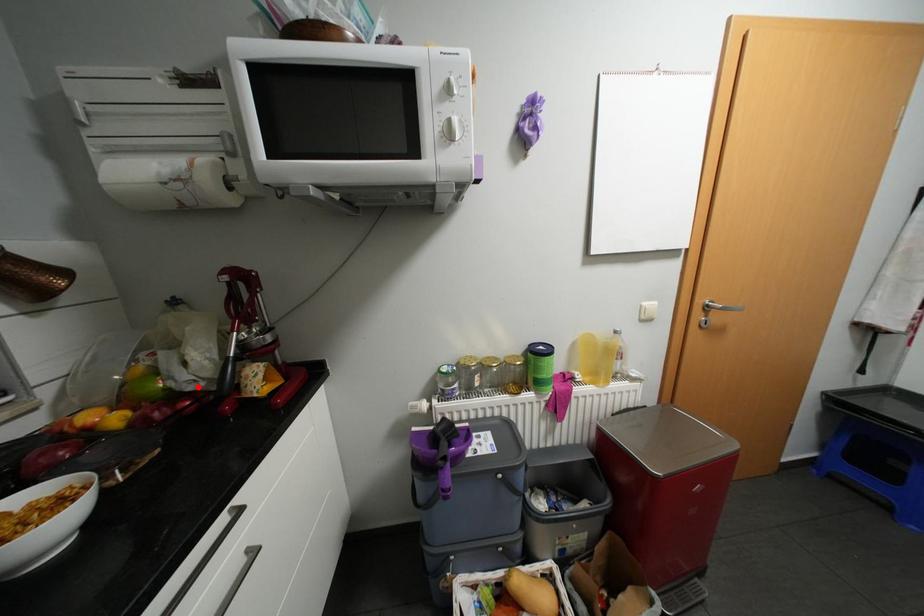
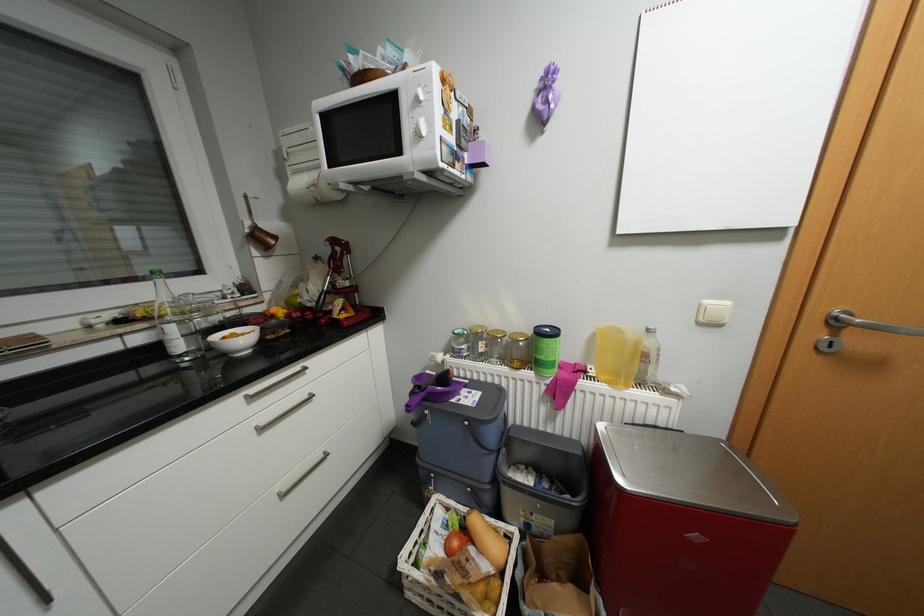
Question: I am providing you with two images of the same scene from different viewpoints. A red point is marked on the first image. Can you still see the location of the red point in image 2?

Choices:
 (A) Yes
 (B) No

Answer: (A)